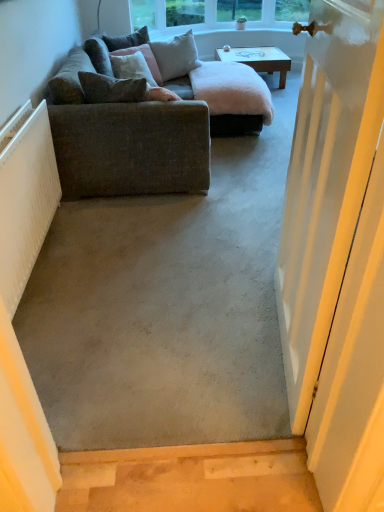
The image size is (384, 512). In order to click on velvet brown pillow at upper left, which is the 3th pillow from back to front in this screenshot , I will do (x=145, y=59).

What do you see at coordinates (145, 59) in the screenshot? The image size is (384, 512). I see `velvet brown pillow at upper left, which is the 3th pillow from back to front` at bounding box center [145, 59].

This screenshot has width=384, height=512. What do you see at coordinates (112, 89) in the screenshot?
I see `textured gray pillow at left, which ranks as the 4th pillow in back-to-front order` at bounding box center [112, 89].

This screenshot has height=512, width=384. What do you see at coordinates (25, 198) in the screenshot? I see `white ribbed radiator at left` at bounding box center [25, 198].

Where is `white ribbed radiator at left`? The image size is (384, 512). white ribbed radiator at left is located at coordinates (25, 198).

Describe the element at coordinates (148, 120) in the screenshot. I see `textured gray couch at left` at that location.

The height and width of the screenshot is (512, 384). I want to click on textured gray couch at left, so click(x=148, y=120).

Locate an element on the screen. light gray fabric pillow at upper center, which is counted as the third pillow, starting from the front is located at coordinates (176, 56).

Is white ribbed radiator at left oriented away from velvet brown pillow at upper left, which is the 3th pillow from back to front?

No.

From a real-world perspective, is white ribbed radiator at left above or below velvet brown pillow at upper left, which is the 3th pillow from back to front?

white ribbed radiator at left is situated lower than velvet brown pillow at upper left, which is the 3th pillow from back to front, in the real world.

At what (x,y) coordinates should I click in order to perform the action: click on the 1st pillow directly above the white ribbed radiator at left (from a real-world perspective). Please return your answer as a coordinate pair (x, y). Image resolution: width=384 pixels, height=512 pixels. Looking at the image, I should click on (145, 59).

Based on the photo, between white ribbed radiator at left and velvet brown pillow at upper left, which is counted as the 2th pillow, starting from the front, which one has more height?

With more height is white ribbed radiator at left.

Would you say velvet green pillow at upper left, the fourth pillow from the front, is outside textured gray pillow at left, which ranks as the 4th pillow in back-to-front order?

Yes, velvet green pillow at upper left, the fourth pillow from the front, is not within textured gray pillow at left, which ranks as the 4th pillow in back-to-front order.

Consider the image. Is there a large distance between velvet green pillow at upper left, the fourth pillow from the front, and textured gray pillow at left, the first pillow from the front?

Yes.

Can you confirm if velvet green pillow at upper left, the fourth pillow from the front, is thinner than textured gray pillow at left, the first pillow from the front?

No.

Is velvet green pillow at upper left, the 1th pillow in the back-to-front sequence, facing towards textured gray pillow at left, the first pillow from the front?

No, velvet green pillow at upper left, the 1th pillow in the back-to-front sequence, is not aimed at textured gray pillow at left, the first pillow from the front.

Is velvet green pillow at upper left, the fourth pillow from the front, wider or thinner than velvet brown pillow at upper left, which is counted as the 2th pillow, starting from the front?

In the image, velvet green pillow at upper left, the fourth pillow from the front, appears to be wider than velvet brown pillow at upper left, which is counted as the 2th pillow, starting from the front.

From the image's perspective, is velvet green pillow at upper left, the fourth pillow from the front, located above velvet brown pillow at upper left, which is counted as the 2th pillow, starting from the front?

Yes, from the image's perspective, velvet green pillow at upper left, the fourth pillow from the front, is over velvet brown pillow at upper left, which is counted as the 2th pillow, starting from the front.

Is velvet green pillow at upper left, the 1th pillow in the back-to-front sequence, oriented away from velvet brown pillow at upper left, which is counted as the 2th pillow, starting from the front?

No.

Which is behind, velvet green pillow at upper left, the 1th pillow in the back-to-front sequence, or velvet brown pillow at upper left, which is counted as the 2th pillow, starting from the front?

velvet green pillow at upper left, the 1th pillow in the back-to-front sequence, is behind.

This screenshot has width=384, height=512. What are the coordinates of `the 3rd pillow above the wooden coffee table at center (from a real-world perspective)` in the screenshot? It's located at (127, 40).

Is velvet green pillow at upper left, the fourth pillow from the front, oriented towards wooden coffee table at center?

Yes, velvet green pillow at upper left, the fourth pillow from the front, is facing wooden coffee table at center.

Is white painted wood door at right located outside textured gray couch at left?

Absolutely, white painted wood door at right is external to textured gray couch at left.

How different are the orientations of white painted wood door at right and textured gray couch at left in degrees?

There is a 171-degree angle between the facing directions of white painted wood door at right and textured gray couch at left.

Is white painted wood door at right oriented towards textured gray couch at left?

No, white painted wood door at right is not turned towards textured gray couch at left.

From a real-world perspective, is white painted wood door at right physically below textured gray couch at left?

No.

Find the location of a particular element. The height and width of the screenshot is (512, 384). door below the textured gray pillow at left, which ranks as the 4th pillow in back-to-front order (from a real-world perspective) is located at coordinates (326, 185).

Considering the sizes of objects textured gray pillow at left, the first pillow from the front, and white painted wood door at right in the image provided, who is taller, textured gray pillow at left, the first pillow from the front, or white painted wood door at right?

With more height is white painted wood door at right.

From the picture: Can we say textured gray pillow at left, which ranks as the 4th pillow in back-to-front order, lies outside white painted wood door at right?

Yes, textured gray pillow at left, which ranks as the 4th pillow in back-to-front order, is located beyond the bounds of white painted wood door at right.

Considering the points (91, 82) and (347, 251), which point is in front, point (91, 82) or point (347, 251)?

Point (347, 251)

From a real-world perspective, relative to velvet green pillow at upper left, the fourth pillow from the front, is light gray fabric pillow at upper center, positioned as the 2th pillow in back-to-front order, vertically above or below?

Clearly, from a real-world perspective, light gray fabric pillow at upper center, positioned as the 2th pillow in back-to-front order, is below velvet green pillow at upper left, the fourth pillow from the front.

Does point (168, 41) come behind point (146, 30)?

Yes.

Is light gray fabric pillow at upper center, which is counted as the third pillow, starting from the front, taller than velvet green pillow at upper left, the 1th pillow in the back-to-front sequence?

Correct, light gray fabric pillow at upper center, which is counted as the third pillow, starting from the front, is much taller as velvet green pillow at upper left, the 1th pillow in the back-to-front sequence.

Is light gray fabric pillow at upper center, which is counted as the third pillow, starting from the front, looking in the opposite direction of velvet green pillow at upper left, the fourth pillow from the front?

Yes, light gray fabric pillow at upper center, which is counted as the third pillow, starting from the front, is positioned with its back facing velvet green pillow at upper left, the fourth pillow from the front.

Find the location of `radiator that appears in front of the velvet brown pillow at upper left, which is the 3th pillow from back to front`. radiator that appears in front of the velvet brown pillow at upper left, which is the 3th pillow from back to front is located at coordinates point(25,198).

Where is `pillow that is the 2nd one when counting rightward from the velvet green pillow at upper left, the fourth pillow from the front`? pillow that is the 2nd one when counting rightward from the velvet green pillow at upper left, the fourth pillow from the front is located at coordinates (112, 89).

When comparing their distances from textured gray pillow at left, which ranks as the 4th pillow in back-to-front order, does white painted wood door at right or velvet brown pillow at upper left, which is counted as the 2th pillow, starting from the front, seem closer?

velvet brown pillow at upper left, which is counted as the 2th pillow, starting from the front, is positioned closer to the anchor textured gray pillow at left, which ranks as the 4th pillow in back-to-front order.

Which object lies nearer to the anchor point light gray fabric pillow at upper center, which is counted as the third pillow, starting from the front, white painted wood door at right or textured gray pillow at left, the first pillow from the front?

The object closer to light gray fabric pillow at upper center, which is counted as the third pillow, starting from the front, is textured gray pillow at left, the first pillow from the front.

Which object lies nearer to the anchor point velvet green pillow at upper left, the fourth pillow from the front, white ribbed radiator at left or velvet brown pillow at upper left, which is counted as the 2th pillow, starting from the front?

The object closer to velvet green pillow at upper left, the fourth pillow from the front, is velvet brown pillow at upper left, which is counted as the 2th pillow, starting from the front.

Which object lies nearer to the anchor point velvet green pillow at upper left, the fourth pillow from the front, velvet brown pillow at upper left, which is the 3th pillow from back to front, or wooden coffee table at center?

Based on the image, velvet brown pillow at upper left, which is the 3th pillow from back to front, appears to be nearer to velvet green pillow at upper left, the fourth pillow from the front.

Estimate the real-world distances between objects in this image. Which object is closer to light gray fabric pillow at upper center, which is counted as the third pillow, starting from the front, textured gray couch at left or velvet green pillow at upper left, the 1th pillow in the back-to-front sequence?

The object closer to light gray fabric pillow at upper center, which is counted as the third pillow, starting from the front, is velvet green pillow at upper left, the 1th pillow in the back-to-front sequence.

When comparing their distances from wooden coffee table at center, does white painted wood door at right or textured gray pillow at left, which ranks as the 4th pillow in back-to-front order, seem further?

white painted wood door at right is positioned further to the anchor wooden coffee table at center.

When comparing their distances from textured gray pillow at left, which ranks as the 4th pillow in back-to-front order, does wooden coffee table at center or white painted wood door at right seem closer?

Based on the image, white painted wood door at right appears to be nearer to textured gray pillow at left, which ranks as the 4th pillow in back-to-front order.

Considering their positions, is white painted wood door at right positioned closer to velvet brown pillow at upper left, which is the 3th pillow from back to front, than wooden coffee table at center?

The object closer to velvet brown pillow at upper left, which is the 3th pillow from back to front, is wooden coffee table at center.

Where is `pillow located between textured gray pillow at left, which ranks as the 4th pillow in back-to-front order, and light gray fabric pillow at upper center, which is counted as the third pillow, starting from the front, in the depth direction`? The image size is (384, 512). pillow located between textured gray pillow at left, which ranks as the 4th pillow in back-to-front order, and light gray fabric pillow at upper center, which is counted as the third pillow, starting from the front, in the depth direction is located at coordinates tap(145, 59).

Locate an element on the screen. The width and height of the screenshot is (384, 512). studio couch between white ribbed radiator at left and wooden coffee table at center from front to back is located at coordinates (148, 120).

The image size is (384, 512). I want to click on radiator located between white painted wood door at right and velvet brown pillow at upper left, which is counted as the 2th pillow, starting from the front, in the depth direction, so click(25, 198).

I want to click on radiator located between white painted wood door at right and textured gray pillow at left, which ranks as the 4th pillow in back-to-front order, in the depth direction, so click(25, 198).